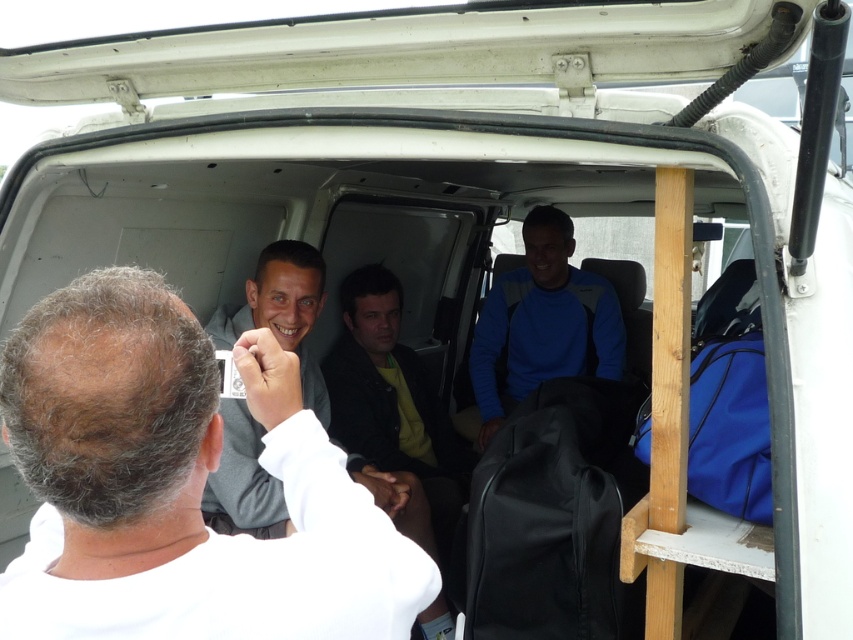
You are standing outside the open rear door of the van and want to hand a small note to the person wearing the white matte shirt at center. Can you reach them without entering the van?

The white matte shirt at center is 28.01 inches away from the viewer, so you can reach them without entering the van since the distance is relatively short.

You are a delivery driver who needs to ensure that the packages in the van are visible to all passengers. You notice the white matte shirt at center and the gray matte jacket at center. Which clothing item is shorter in height?

The white matte shirt at center is shorter in height compared to the gray matte jacket at center.

You are a delivery driver who needs to determine which jacket is bigger between the blue fleece jacket at center and the gray matte jacket at center to decide which one to pack first. Which jacket has a larger size?

The blue fleece jacket at center has a larger size compared to the gray matte jacket at center, so you should pack the blue fleece jacket at center first.